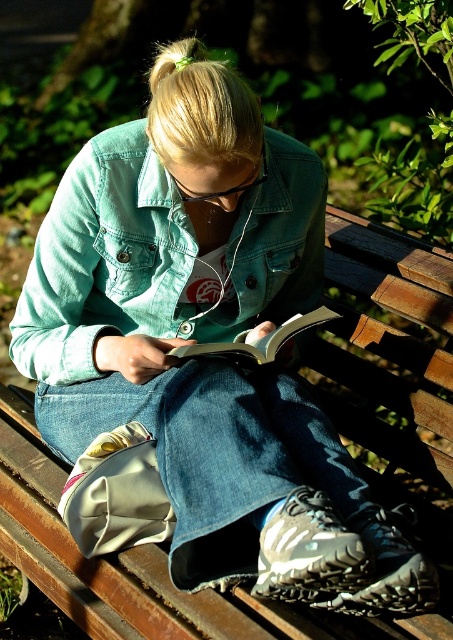
You are a tailor who needs to determine which item, the denim jacket at center or the hardcover book at center, requires more fabric for a custom replica. Based on the scene, which one would you prioritize?

The denim jacket at center is bigger than the hardcover book at center, so the denim jacket at center would require more fabric for a custom replica and should be prioritized.

You are a tailor measuring the distance between the denim jacket at center and the hardcover book at center for a custom fitting. Can you confirm if the space between them is more than 9 inches?

The distance between the denim jacket at center and the hardcover book at center is 10.00 inches, which is more than 9 inches.

You are a photographer trying to capture the perfect shot of the denim jacket at center. To do this, you need to know its exact position. Where is the denim jacket located in terms of coordinates?

The denim jacket at center is located at coordinates point (101, 259).